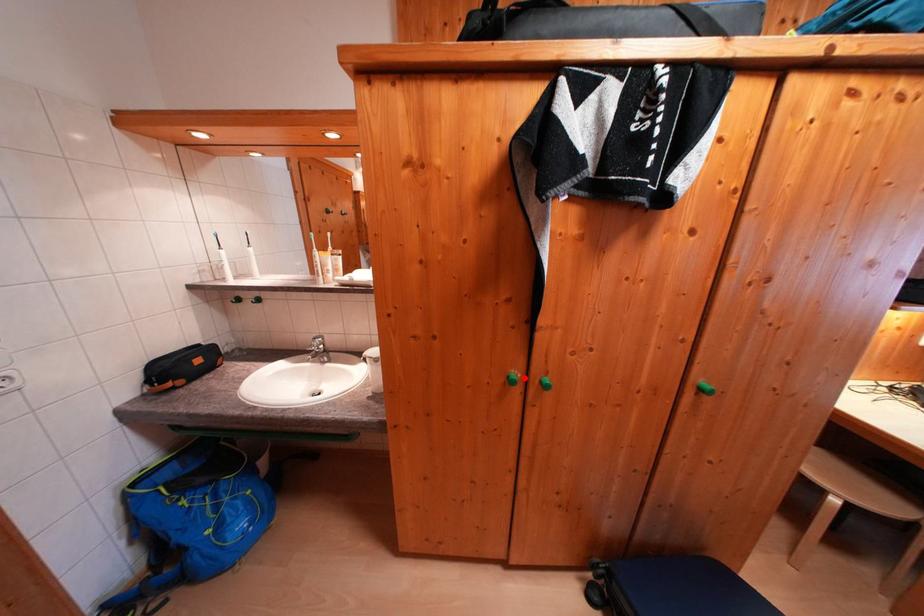
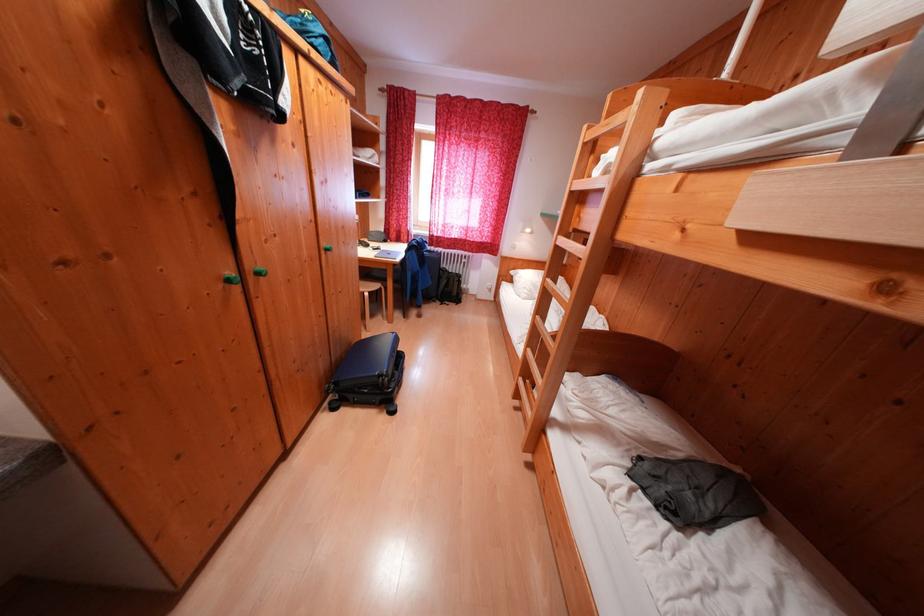
In the second image, find the point that corresponds to the highlighted location in the first image.

(238, 278)